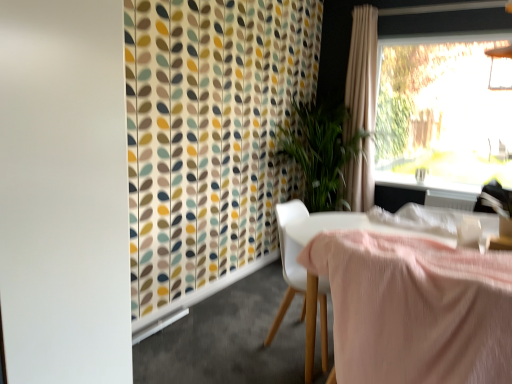
At what (x,y) coordinates should I click in order to perform the action: click on vacant space positioned to the left of white plastic chair at center. Please return your answer as a coordinate pair (x, y). The image size is (512, 384). Looking at the image, I should click on (237, 344).